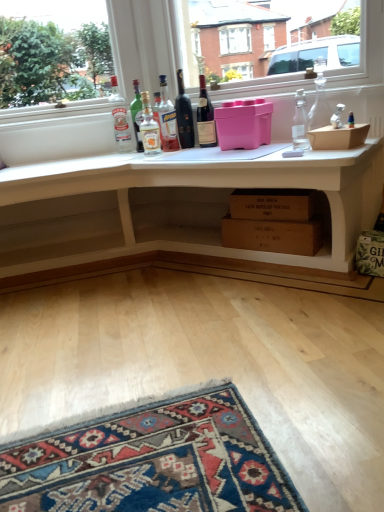
Question: In terms of height, does pink plastic container at center, which ranks as the 1th box in top-to-bottom order, look taller or shorter compared to translucent glass bottle at center, which ranks as the second bottle in left-to-right order?

Choices:
 (A) short
 (B) tall

Answer: (A)

Question: In terms of width, does pink plastic container at center, marked as the second box in a bottom-to-top arrangement, look wider or thinner when compared to translucent glass bottle at center, which ranks as the second bottle in left-to-right order?

Choices:
 (A) wide
 (B) thin

Answer: (A)

Question: Based on their relative distances, which object is nearer to the clear glass bottle at center, which ranks as the seventh bottle in right-to-left order?

Choices:
 (A) clear glass bottle at upper right, which ranks as the 6th bottle in left-to-right order
 (B) dark red glass wine bottle at center, placed as the 5th bottle when sorted from left to right
 (C) green paper bag at lower right
 (D) brown cardboard box at center, marked as the 2th box in a top-to-bottom arrangement
 (E) dark glass wine bottle at center, placed as the fourth bottle when sorted from left to right

Answer: (E)

Question: Which object is the closest to the white matte desk at center?

Choices:
 (A) green paper bag at lower right
 (B) translucent glass bottle at center, which is counted as the 3th bottle, starting from the left
 (C) brown cardboard box at center, marked as the 2th box in a top-to-bottom arrangement
 (D) dark glass wine bottle at center, placed as the fourth bottle when sorted from left to right
 (E) pink plastic container at center, which ranks as the 1th box in top-to-bottom order

Answer: (C)